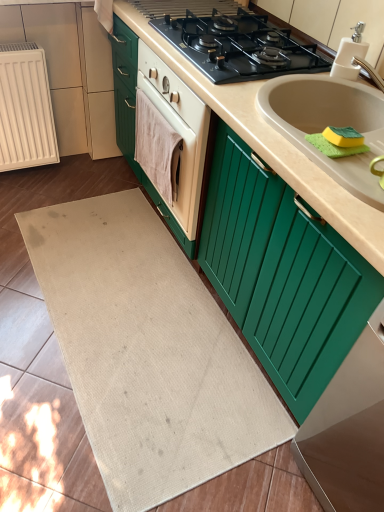
This screenshot has width=384, height=512. I want to click on green matte cabinet at lower right, so click(349, 429).

Which is nearer, (273, 41) or (152, 176)?

Point (273, 41).

Between black matte gas stove at upper center and pink fabric hand towel at center, which one has smaller size?

Smaller between the two is pink fabric hand towel at center.

Do you think black matte gas stove at upper center is within pink fabric hand towel at center, or outside of it?

black matte gas stove at upper center exists outside the volume of pink fabric hand towel at center.

Is black matte gas stove at upper center aimed at pink fabric hand towel at center?

No, black matte gas stove at upper center does not turn towards pink fabric hand towel at center.

Based on the photo, is green matte cabinet at lower right surrounded by white ribbed radiator at left?

No.

Is white ribbed radiator at left to the right of green matte cabinet at lower right from the viewer's perspective?

Incorrect, white ribbed radiator at left is not on the right side of green matte cabinet at lower right.

Based on the photo, is white ribbed radiator at left bigger than green matte cabinet at lower right?

No, white ribbed radiator at left is not bigger than green matte cabinet at lower right.

Locate an element on the screen. The image size is (384, 512). appliance that is above the white ribbed radiator at left (from a real-world perspective) is located at coordinates (349, 429).

Which object is further away from the camera, white ribbed radiator at left or pink fabric hand towel at center?

Positioned behind is white ribbed radiator at left.

Would you consider white ribbed radiator at left to be distant from pink fabric hand towel at center?

Actually, white ribbed radiator at left and pink fabric hand towel at center are a little close together.

Based on their positions, is white ribbed radiator at left located to the left or right of pink fabric hand towel at center?

white ribbed radiator at left is to the left of pink fabric hand towel at center.

Considering the sizes of white ribbed radiator at left and pink fabric hand towel at center in the image, is white ribbed radiator at left taller or shorter than pink fabric hand towel at center?

Considering their sizes, white ribbed radiator at left has more height than pink fabric hand towel at center.

How much distance is there between black matte gas stove at upper center and beige fabric bath mat at center?

black matte gas stove at upper center is 38.10 inches from beige fabric bath mat at center.

Can you confirm if black matte gas stove at upper center is bigger than beige fabric bath mat at center?

Incorrect, black matte gas stove at upper center is not larger than beige fabric bath mat at center.

From the picture: Is black matte gas stove at upper center not within beige fabric bath mat at center?

That's correct, black matte gas stove at upper center is outside of beige fabric bath mat at center.

From a real-world perspective, which object stands above the other?

In real-world perspective, black matte gas stove at upper center is above.

From the image's perspective, which is above, black matte gas stove at upper center or beige matte countertop at center?

From the image's view, black matte gas stove at upper center is above.

Is black matte gas stove at upper center inside the boundaries of beige matte countertop at center, or outside?

black matte gas stove at upper center is enclosed within beige matte countertop at center.

Which object is thinner, black matte gas stove at upper center or beige matte countertop at center?

black matte gas stove at upper center is thinner.

From a real-world perspective, who is located higher, black matte gas stove at upper center or beige matte countertop at center?

In real-world perspective, black matte gas stove at upper center is above.

Does white ribbed radiator at left turn towards black matte gas stove at upper center?

No, white ribbed radiator at left is not facing towards black matte gas stove at upper center.

Which point is more distant from viewer, (12, 72) or (284, 33)?

The point (12, 72) is farther from the camera.

Does white ribbed radiator at left appear on the right side of black matte gas stove at upper center?

No.

Between white ribbed radiator at left and yellow-green sponge at sink right, which one is positioned in front?

yellow-green sponge at sink right.

Does white ribbed radiator at left appear on the left side of yellow-green sponge at sink right?

Correct, you'll find white ribbed radiator at left to the left of yellow-green sponge at sink right.

What's the angular difference between white ribbed radiator at left and yellow-green sponge at sink right's facing directions?

The angular difference between white ribbed radiator at left and yellow-green sponge at sink right is 90.5 degrees.

Locate an element on the screen. This screenshot has width=384, height=512. hand towel directly beneath the black matte gas stove at upper center (from a real-world perspective) is located at coordinates pos(154,145).

This screenshot has height=512, width=384. Find the location of `appliance that appears below the white ribbed radiator at left (from the image's perspective)`. appliance that appears below the white ribbed radiator at left (from the image's perspective) is located at coordinates (349, 429).

Looking at the image, which one is located closer to black matte gas stove at upper center, beige matte countertop at center or beige fabric bath mat at center?

Based on the image, beige matte countertop at center appears to be nearer to black matte gas stove at upper center.

From the image, which object appears to be nearer to yellow-green sponge at sink right, white ribbed radiator at left or beige matte countertop at center?

Based on the image, beige matte countertop at center appears to be nearer to yellow-green sponge at sink right.

Considering their positions, is pink fabric hand towel at center positioned closer to yellow-green sponge at sink right than white ribbed radiator at left?

pink fabric hand towel at center is positioned closer to the anchor yellow-green sponge at sink right.

Estimate the real-world distances between objects in this image. Which object is closer to white ribbed radiator at left, beige fabric bath mat at center or yellow-green sponge at sink right?

Among the two, beige fabric bath mat at center is located nearer to white ribbed radiator at left.

Estimate the real-world distances between objects in this image. Which object is further from yellow-green sponge at sink right, green matte cabinet at lower right or white ribbed radiator at left?

white ribbed radiator at left.

From the image, which object appears to be farther from white ribbed radiator at left, yellow-green sponge at sink right or green matte cabinet at lower right?

Based on the image, green matte cabinet at lower right appears to be further to white ribbed radiator at left.

Looking at the image, which one is located further to white ribbed radiator at left, beige fabric bath mat at center or green matte cabinet at lower right?

green matte cabinet at lower right lies further to white ribbed radiator at left than the other object.

Which object lies nearer to the anchor point yellow-green sponge at sink right, beige fabric bath mat at center or beige matte countertop at center?

Based on the image, beige matte countertop at center appears to be nearer to yellow-green sponge at sink right.

Where is `gas stove between pink fabric hand towel at center and yellow-green sponge at sink right`? The height and width of the screenshot is (512, 384). gas stove between pink fabric hand towel at center and yellow-green sponge at sink right is located at coordinates (238, 46).

At what (x,y) coordinates should I click in order to perform the action: click on soap between black matte gas stove at upper center and beige fabric bath mat at center vertically. Please return your answer as a coordinate pair (x, y). This screenshot has width=384, height=512. Looking at the image, I should click on (343, 136).

The width and height of the screenshot is (384, 512). I want to click on counter top between pink fabric hand towel at center and green matte cabinet at lower right from top to bottom, so click(x=272, y=145).

What are the coordinates of `hand towel between white ribbed radiator at left and green matte cabinet at lower right in the horizontal direction` in the screenshot? It's located at (154, 145).